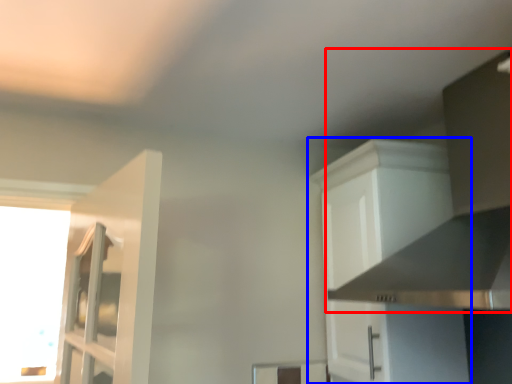
Question: Which object appears farthest to the camera in this image, vent (highlighted by a red box) or cabinetry (highlighted by a blue box)?

Choices:
 (A) vent
 (B) cabinetry

Answer: (B)